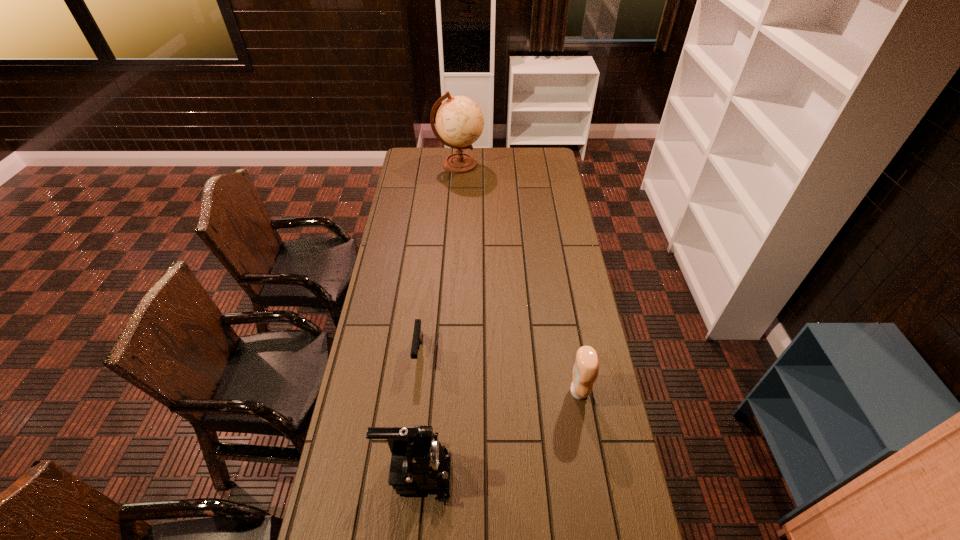
Locate an element on the screen. This screenshot has width=960, height=540. the farthest object is located at coordinates (459, 120).

Where is `the tallest object`? the tallest object is located at coordinates click(x=459, y=120).

Find the location of a particular element. The height and width of the screenshot is (540, 960). the nearest object is located at coordinates (418, 462).

In order to click on camcorder in this screenshot , I will do `click(418, 462)`.

Find the location of a particular element. The image size is (960, 540). the rightmost object is located at coordinates (586, 368).

You are a GUI agent. You are given a task and a screenshot of the screen. Output one action in this format:
    pyautogui.click(x=<x>, y=<y>)
    Task: Click on the second shortest object
    
    Given the screenshot: What is the action you would take?
    pos(586,368)

Image resolution: width=960 pixels, height=540 pixels. Find the location of `pistol`. pistol is located at coordinates (417, 339).

Locate an element on the screen. Image resolution: width=960 pixels, height=540 pixels. the shortest object is located at coordinates (417, 339).

Locate an element on the screen. vacant space located 0.090m on the surface of the globe is located at coordinates (500, 164).

Image resolution: width=960 pixels, height=540 pixels. What are the coordinates of `free space located on the lens mount of the camcorder` in the screenshot? It's located at (552, 472).